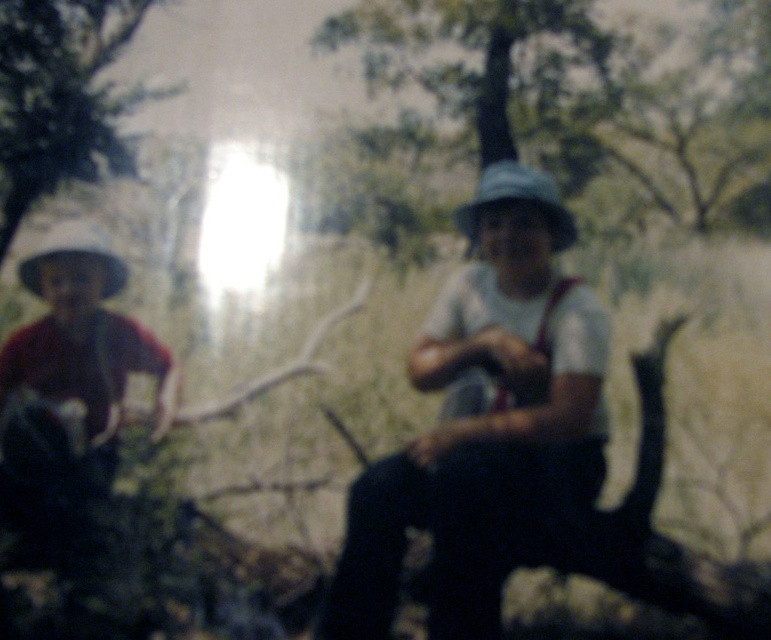
Question: Does matte white hat at center appear on the right side of green leafy tree at upper left?

Choices:
 (A) no
 (B) yes

Answer: (B)

Question: Is matte white hat at center positioned in front of green leafy tree at upper left?

Choices:
 (A) no
 (B) yes

Answer: (B)

Question: Which of the following is the closest to the observer?

Choices:
 (A) (477, 456)
 (B) (76, 136)

Answer: (A)

Question: Which of the following is the closest to the observer?

Choices:
 (A) (561, 344)
 (B) (123, 164)

Answer: (A)

Question: Can you confirm if matte white hat at center is positioned above green leafy tree at upper left?

Choices:
 (A) yes
 (B) no

Answer: (B)

Question: Which of the following is the farthest from the observer?

Choices:
 (A) green leafy tree at upper left
 (B) matte white hat at center

Answer: (A)